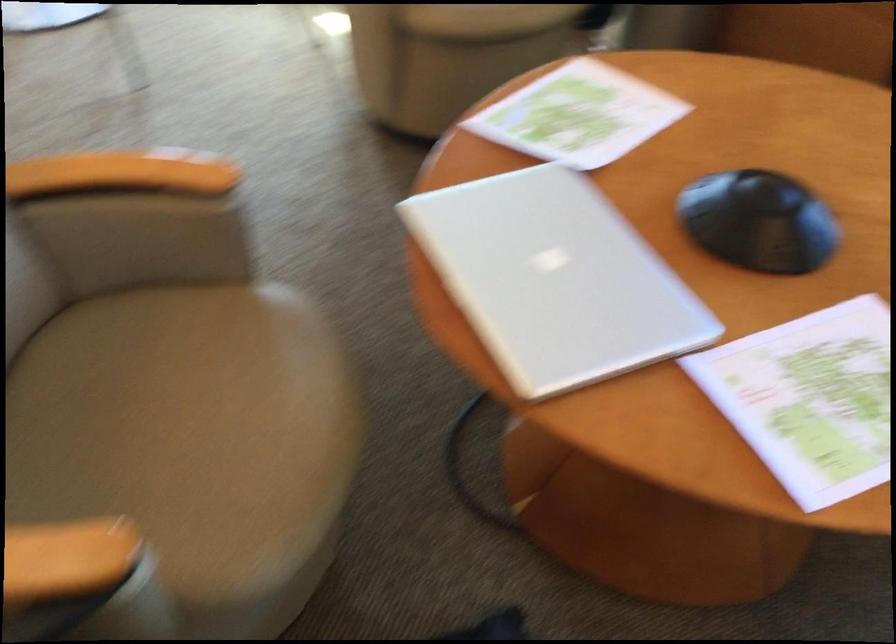
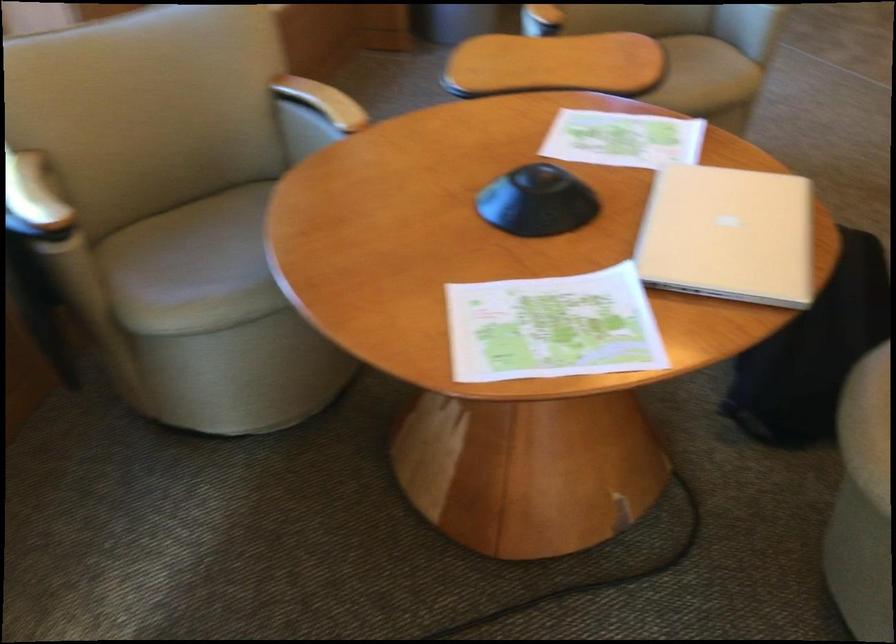
In the second image, find the point that corresponds to [268,375] in the first image.

(867, 426)